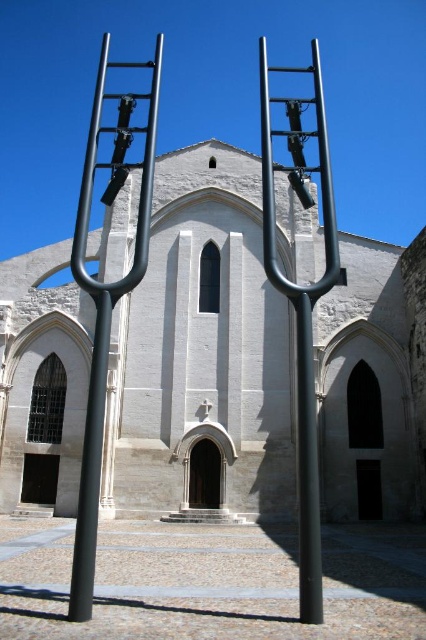
You are an art curator planning to move the metallic black ladder at center and the black matte pole at center to a new exhibition space. The ceiling height there is 3 meters. Can both items fit vertically without bending or damaging them? Please explain your reasoning based on their sizes relative to each other and the ceiling height.

The metallic black ladder at center is much taller than the black matte pole at center. Since the ceiling height is 3 meters, we need to know the exact height of the taller item. However, since the ladder is described as much taller than the pole, if the pole alone exceeds 3 meters, both cannot fit. If the pole is under 3 meters but the ladder exceeds it, only the pole can fit. Without specific measurements, we can only infer that the ladder poses a greater risk of not fitting due to its greater height.

You are an art installer who needs to secure a safety net between the polished metal ladder at center and the black matte pole at center. Based on their positions, which object should the safety net be anchored to first?

The polished metal ladder at center is located above the black matte pole at center, so the safety net should be anchored to the black matte pole at center first as it is the lower structure.